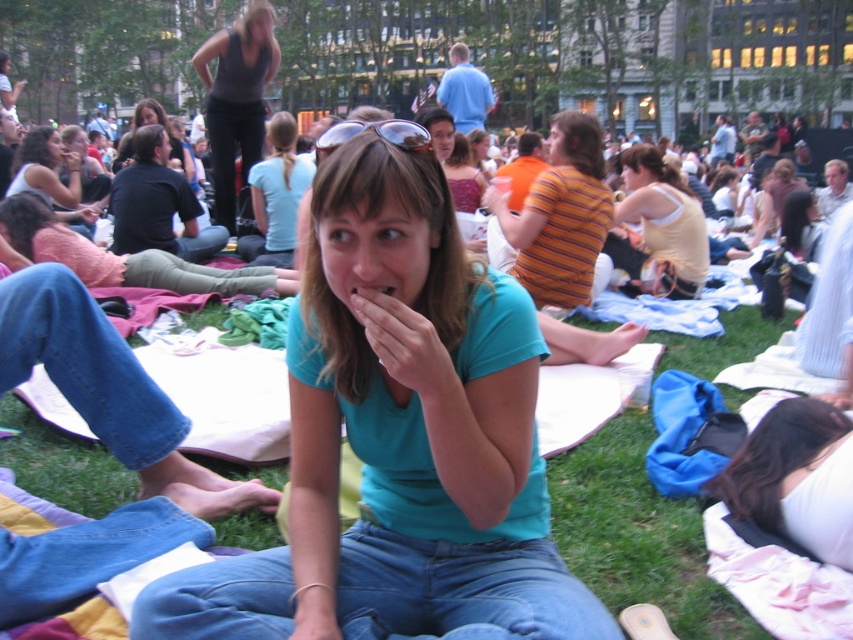
Is dark gray tank top at upper center taller than light blue t-shirt at center?

Correct, dark gray tank top at upper center is much taller as light blue t-shirt at center.

This screenshot has width=853, height=640. In order to click on dark gray tank top at upper center in this screenshot , I will do `click(236, 97)`.

The height and width of the screenshot is (640, 853). What do you see at coordinates (236, 97) in the screenshot? I see `dark gray tank top at upper center` at bounding box center [236, 97].

This screenshot has height=640, width=853. I want to click on dark gray tank top at upper center, so click(236, 97).

Is teal matte shirt at center to the right of matte black shirt at upper left from the viewer's perspective?

Correct, you'll find teal matte shirt at center to the right of matte black shirt at upper left.

Between teal matte shirt at center and matte black shirt at upper left, which one is positioned lower?

Positioned lower is teal matte shirt at center.

Identify the location of teal matte shirt at center. The height and width of the screenshot is (640, 853). (398, 442).

Where is `teal matte shirt at center`? The height and width of the screenshot is (640, 853). teal matte shirt at center is located at coordinates [398, 442].

Between light blue t-shirt at center and matte teal shirt at center, which one is positioned lower?

matte teal shirt at center

Is point (265, 189) positioned in front of point (96, 211)?

That is True.

The height and width of the screenshot is (640, 853). Find the location of `light blue t-shirt at center`. light blue t-shirt at center is located at coordinates (276, 195).